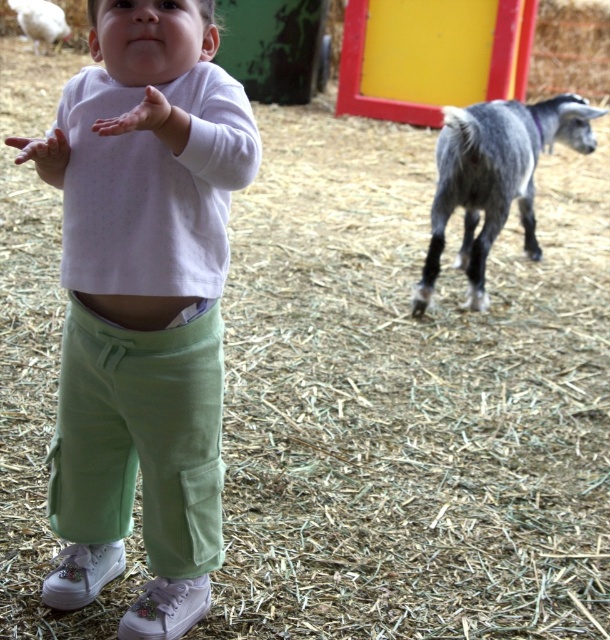
You are a photographer trying to capture a photo of the white fluffy sheep at upper left and the light green cotton pants at center. Which object should you focus on first if you want to ensure both are in focus?

The light green cotton pants at center is taller than the white fluffy sheep at upper left, so you should focus on the light green cotton pants at center first to ensure both are in focus.

Consider the image. You are a photographer standing at point (493, 177). You want to take a picture of the gray woolen goat at right. Is the goat currently in your line of sight?

The gray woolen goat at right is located at point (493, 177), so yes, the photographer is standing exactly at the goat location and can take a picture.

You are a parent at the petting zoo and want to ensure your child stays safe. The child is wearing light green cotton pants at center. The gray woolen goat at right is approaching. Given that the goat moves at 0.5 meters per second and the child can move at 1 meter per second, can the child safely move away to a safe distance of 3 meters before the goat reaches them?

The distance between light green cotton pants at center and gray woolen goat at right is 2.55 meters. The child can move at 1 mps and the goat at 0.5 mps. To reach safety, the child needs to increase the distance by 0.45 meters. Since the child is faster, they can move away and create the needed distance in 0.45 seconds before the goat closes in. Thus, the child can safely move away.